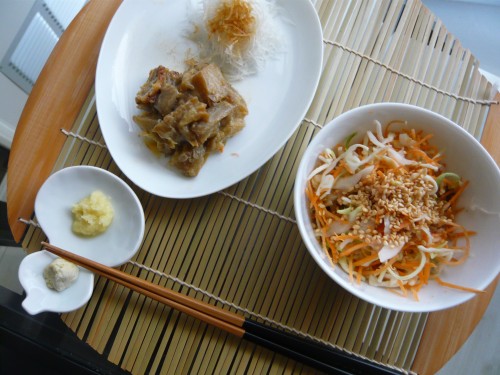
You are a GUI agent. You are given a task and a screenshot of the screen. Output one action in this format:
    pyautogui.click(x=<x>, y=<y>)
    Task: Click on the plate
    The height and width of the screenshot is (375, 500).
    Given the screenshot: What is the action you would take?
    pyautogui.click(x=274, y=124)